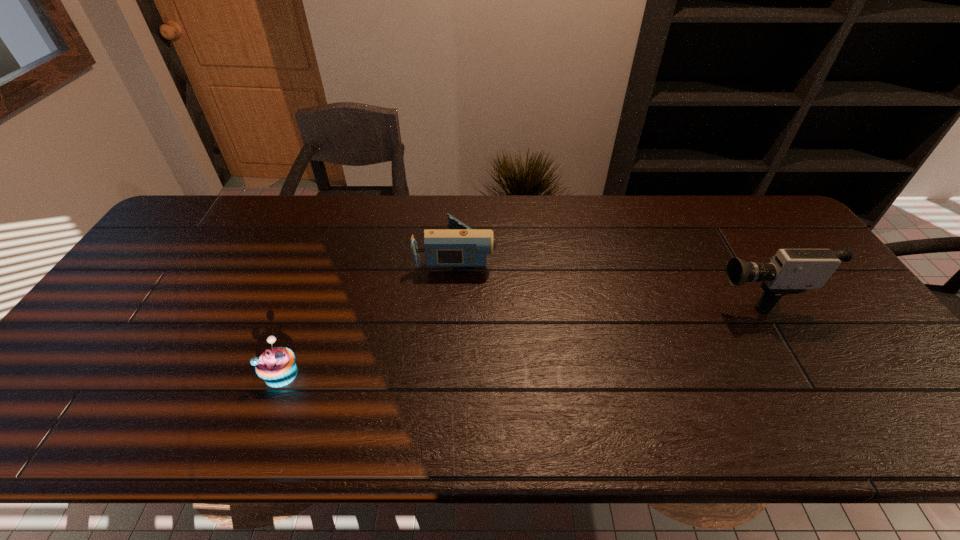
Where is `vacant space located 0.240m on the back of the nearest object`? This screenshot has width=960, height=540. vacant space located 0.240m on the back of the nearest object is located at coordinates (313, 286).

This screenshot has height=540, width=960. Identify the location of object positioned at the far edge. (461, 246).

The width and height of the screenshot is (960, 540). What are the coordinates of `object that is positioned at the right edge` in the screenshot? It's located at (791, 271).

At what (x,y) coordinates should I click in order to perform the action: click on free space at the far edge of the desktop. Please return your answer as a coordinate pair (x, y). Looking at the image, I should click on (496, 235).

Find the location of a particular element. The image size is (960, 540). vacant space at the near edge is located at coordinates (719, 422).

At what (x,y) coordinates should I click in order to perform the action: click on free space at the left edge of the desktop. Please return your answer as a coordinate pair (x, y). Looking at the image, I should click on (164, 289).

This screenshot has height=540, width=960. I want to click on vacant region at the far right corner of the desktop, so click(x=771, y=236).

In order to click on free space between the tallest object and the nearest object in this screenshot , I will do `click(516, 333)`.

You are a GUI agent. You are given a task and a screenshot of the screen. Output one action in this format:
    pyautogui.click(x=<x>, y=<y>)
    Task: Click on the vacant area between the tallest object and the leftmost object
    This screenshot has width=960, height=540.
    Given the screenshot: What is the action you would take?
    pyautogui.click(x=516, y=333)

Locate an element on the screen. The width and height of the screenshot is (960, 540). free space between the tallest object and the left camcorder is located at coordinates pos(604,273).